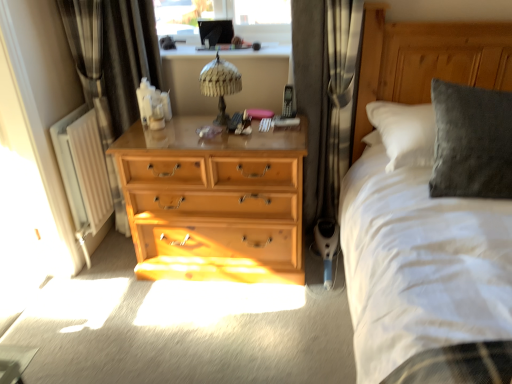
Question: Considering the relative sizes of dark grey fabric curtain at center, placed as the first curtain when sorted from right to left, and black fabric curtain at left, placed as the first curtain when sorted from left to right, in the image provided, is dark grey fabric curtain at center, placed as the first curtain when sorted from right to left, taller than black fabric curtain at left, placed as the first curtain when sorted from left to right,?

Choices:
 (A) no
 (B) yes

Answer: (A)

Question: From the image's perspective, would you say dark grey fabric curtain at center, marked as the 2th curtain in a left-to-right arrangement, is positioned over black fabric curtain at left, placed as the first curtain when sorted from left to right?

Choices:
 (A) no
 (B) yes

Answer: (B)

Question: Is dark grey fabric curtain at center, marked as the 2th curtain in a left-to-right arrangement, beside black fabric curtain at left, placed as the first curtain when sorted from left to right?

Choices:
 (A) yes
 (B) no

Answer: (B)

Question: Does dark grey fabric curtain at center, placed as the first curtain when sorted from right to left, have a larger size compared to black fabric curtain at left, which is the 2th curtain in right-to-left order?

Choices:
 (A) yes
 (B) no

Answer: (A)

Question: Does dark grey fabric curtain at center, marked as the 2th curtain in a left-to-right arrangement, have a lesser height compared to black fabric curtain at left, placed as the first curtain when sorted from left to right?

Choices:
 (A) yes
 (B) no

Answer: (A)

Question: Is black fabric curtain at left, which is the 2th curtain in right-to-left order, inside dark grey fabric curtain at center, marked as the 2th curtain in a left-to-right arrangement?

Choices:
 (A) no
 (B) yes

Answer: (A)

Question: From a real-world perspective, is woven fabric table lamp at center on top of black fabric curtain at left, which is the 2th curtain in right-to-left order?

Choices:
 (A) no
 (B) yes

Answer: (B)

Question: Does woven fabric table lamp at center have a lesser height compared to black fabric curtain at left, placed as the first curtain when sorted from left to right?

Choices:
 (A) no
 (B) yes

Answer: (B)

Question: Does woven fabric table lamp at center come behind black fabric curtain at left, which is the 2th curtain in right-to-left order?

Choices:
 (A) no
 (B) yes

Answer: (B)

Question: Is woven fabric table lamp at center bigger than black fabric curtain at left, placed as the first curtain when sorted from left to right?

Choices:
 (A) no
 (B) yes

Answer: (A)

Question: From a real-world perspective, is woven fabric table lamp at center under black fabric curtain at left, placed as the first curtain when sorted from left to right?

Choices:
 (A) no
 (B) yes

Answer: (A)

Question: Is woven fabric table lamp at center aimed at black fabric curtain at left, which is the 2th curtain in right-to-left order?

Choices:
 (A) yes
 (B) no

Answer: (B)

Question: Does black fabric curtain at left, which is the 2th curtain in right-to-left order, have a larger size compared to dark grey fabric curtain at center, placed as the first curtain when sorted from right to left?

Choices:
 (A) no
 (B) yes

Answer: (A)